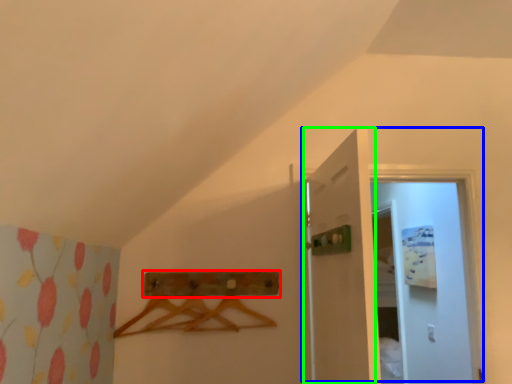
Question: Considering the real-world distances, which object is farthest from drawer (highlighted by a red box)? door (highlighted by a blue box) or door (highlighted by a green box)?

Choices:
 (A) door
 (B) door

Answer: (A)